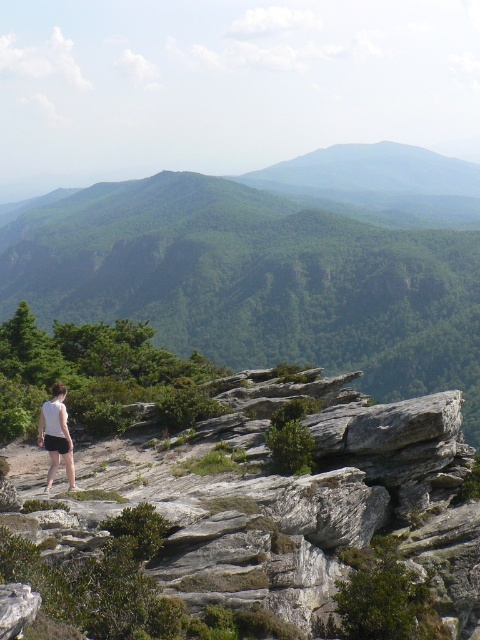
Based on the scene, can you determine if the green grassy mountain at upper center is wider than the white fabric shorts at lower left?

The green grassy mountain at upper center might be wider than white fabric shorts at lower left according to the description.

You are a photographer trying to capture the green leafy mountain at center and the white cotton shorts at lower left in the same frame. Can you adjust your position so that both are visible without one blocking the other?

The white cotton shorts at lower left is behind the green leafy mountain at center, so adjusting your position might allow you to see both by moving to a side angle where the mountain and shorts are not overlapping.

You are standing at the edge of the rocky outcrop and want to take a photo of the green leafy mountain at center. If your camera can focus up to 500 feet, will it be able to capture the mountain clearly?

The green leafy mountain at center is 489.92 feet away from the camera, which is within the camera focus range of 500 feet. Therefore, the camera can capture the mountain clearly.